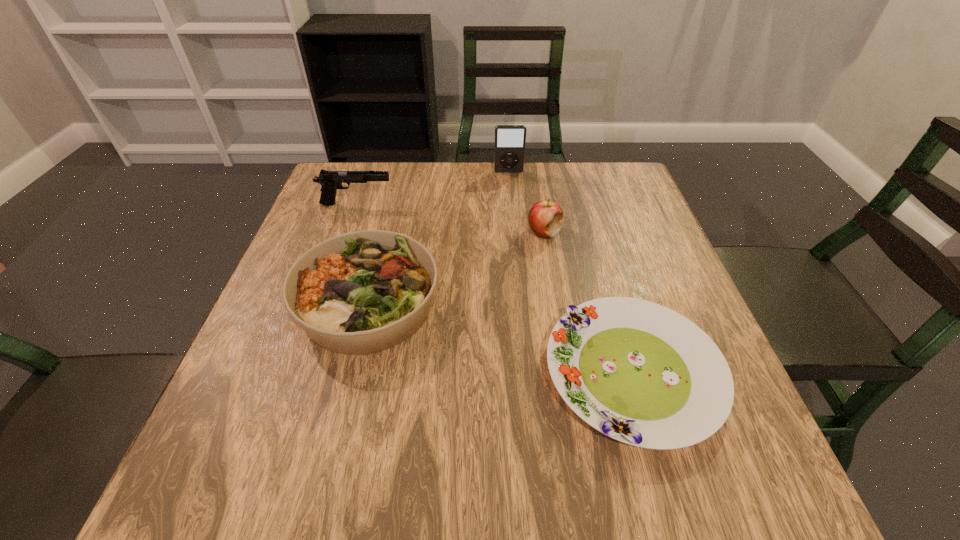
Locate an element on the screen. The image size is (960, 540). vacant space situated 0.270m on the right of the taller salad plate is located at coordinates (570, 303).

Where is `vacant space located 0.070m on the left of the shorter salad plate`? vacant space located 0.070m on the left of the shorter salad plate is located at coordinates (x=507, y=373).

I want to click on iPod that is at the far edge, so click(509, 152).

The width and height of the screenshot is (960, 540). What are the coordinates of `gun positioned at the far edge` in the screenshot? It's located at (330, 181).

You are a GUI agent. You are given a task and a screenshot of the screen. Output one action in this format:
    pyautogui.click(x=<x>, y=<y>)
    Task: Click on the object at the near edge
    The height and width of the screenshot is (540, 960).
    Given the screenshot: What is the action you would take?
    pyautogui.click(x=638, y=372)

Where is `gun at the left edge`? gun at the left edge is located at coordinates (330, 181).

Where is `salad plate present at the left edge`? This screenshot has height=540, width=960. salad plate present at the left edge is located at coordinates (362, 292).

I want to click on object present at the right edge, so click(x=638, y=372).

Where is `object that is at the far left corner`? object that is at the far left corner is located at coordinates (330, 181).

Locate an element on the screen. object located at the near right corner is located at coordinates point(638,372).